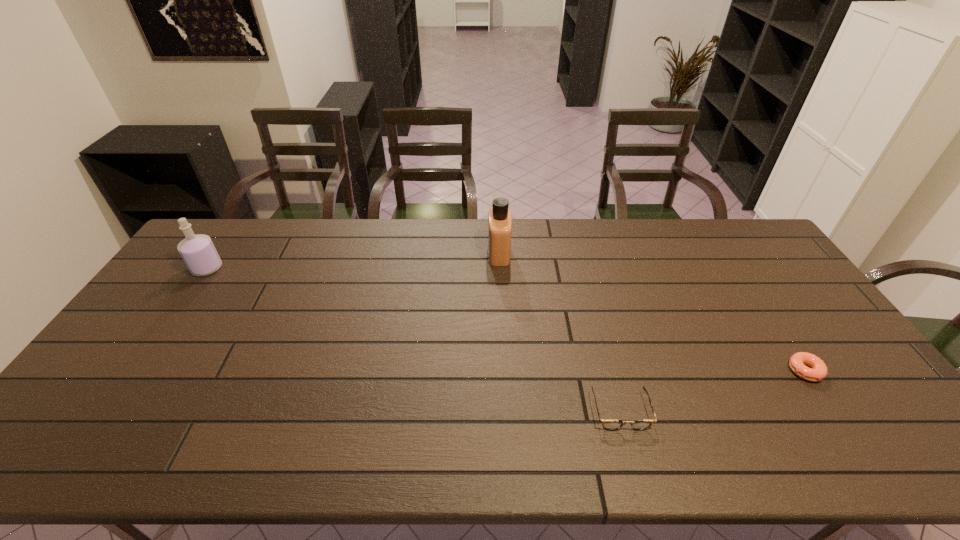
Identify the location of free area in between the doughnut and the leftmost object. This screenshot has width=960, height=540. (506, 320).

Image resolution: width=960 pixels, height=540 pixels. I want to click on object that stands as the closest to the second shortest object, so click(x=818, y=371).

Locate which object is the closest to the shortest object. Please provide its 2D coordinates. Your answer should be formatted as a tuple, i.e. [(x, y)], where the tuple contains the x and y coordinates of a point satisfying the conditions above.

[(611, 425)]

Where is `blank space that satisfies the following two spatial constraints: 1. on the front label of the third object from right to left; 2. on the right side of the second nearest object`? blank space that satisfies the following two spatial constraints: 1. on the front label of the third object from right to left; 2. on the right side of the second nearest object is located at coordinates [x=505, y=370].

This screenshot has height=540, width=960. I want to click on free spot that satisfies the following two spatial constraints: 1. on the front label of the right perfume; 2. on the back side of the second nearest object, so click(x=505, y=370).